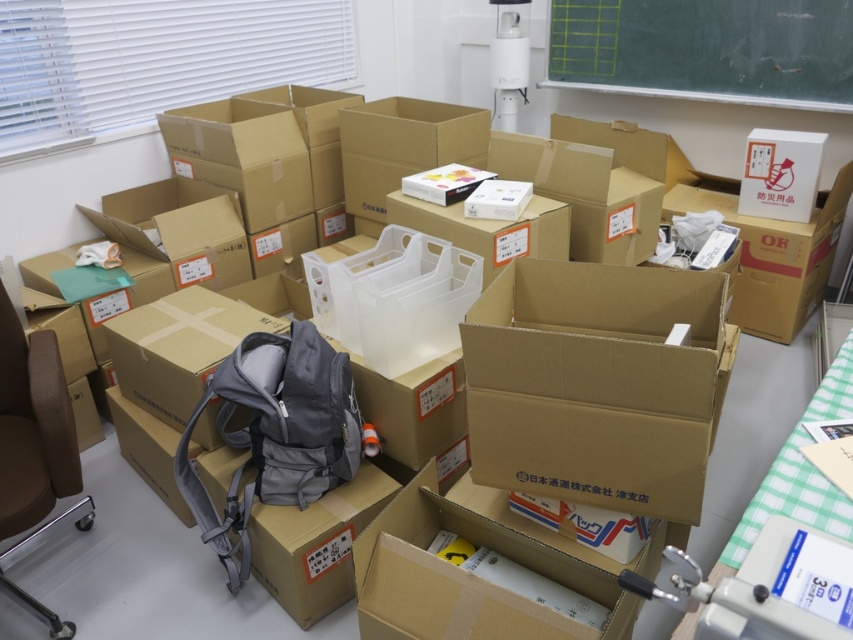
Question: Is gray fabric backpack at center behind green checkered tablecloth at lower right?

Choices:
 (A) no
 (B) yes

Answer: (B)

Question: Which point appears closest to the camera in this image?

Choices:
 (A) (809, 477)
 (B) (828, 45)
 (C) (274, 384)
 (D) (64, 476)

Answer: (A)

Question: Observing the image, what is the correct spatial positioning of green chalkboard at upper right in reference to brown leather swivel chair at left?

Choices:
 (A) left
 (B) right

Answer: (B)

Question: Which point is closer to the camera?

Choices:
 (A) green chalkboard at upper right
 (B) green checkered tablecloth at lower right

Answer: (B)

Question: Does green chalkboard at upper right have a greater width compared to gray fabric backpack at center?

Choices:
 (A) yes
 (B) no

Answer: (A)

Question: Which object is farther from the camera taking this photo?

Choices:
 (A) green checkered tablecloth at lower right
 (B) green chalkboard at upper right
 (C) brown leather swivel chair at left

Answer: (B)